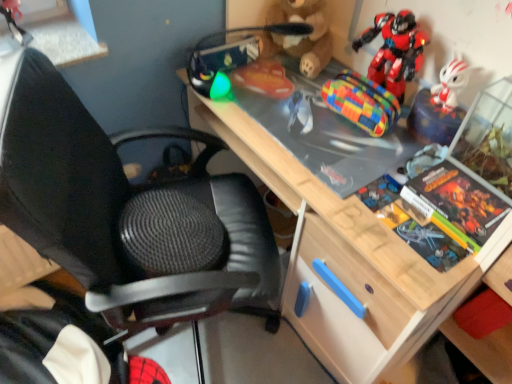
Question: Considering the positions of rubberized orange toy at upper center, arranged as the first toy when viewed from the left, and shiny plastic robot at upper right, which appears as the 1th toy when viewed from the right, in the image, is rubberized orange toy at upper center, arranged as the first toy when viewed from the left, taller or shorter than shiny plastic robot at upper right, which appears as the 1th toy when viewed from the right,?

Choices:
 (A) short
 (B) tall

Answer: (A)

Question: Relative to shiny plastic robot at upper right, which appears as the 1th toy when viewed from the right, is rubberized orange toy at upper center, arranged as the first toy when viewed from the left, in front or behind?

Choices:
 (A) behind
 (B) front

Answer: (B)

Question: Which object is the closest to the rubberized orange toy at upper center, arranged as the first toy when viewed from the left?

Choices:
 (A) wooden desk at center
 (B) black mesh chair at center
 (C) shiny plastic robot at upper right, which appears as the 1th toy when viewed from the right
 (D) multicolored woven pouch at center, placed as the third toy when sorted from left to right
 (E) hardcover book at right

Answer: (D)

Question: Which object is positioned closest to the hardcover book at right?

Choices:
 (A) shiny plastic robot at upper right, which appears as the 1th toy when viewed from the right
 (B) wooden desk at center
 (C) brown plush bear at upper center, the 3th toy viewed from the right
 (D) black mesh chair at center
 (E) rubberized orange toy at upper center, which is the 4th toy in right-to-left order

Answer: (B)